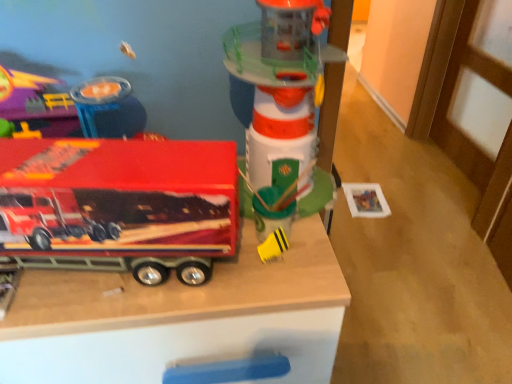
Question: Is wooden toy truck at center positioned behind yellow rubber duck at center, which is counted as the 2th toy, starting from the right?

Choices:
 (A) yes
 (B) no

Answer: (B)

Question: Is wooden toy truck at center facing away from yellow rubber duck at center, the 3th toy viewed from the left?

Choices:
 (A) no
 (B) yes

Answer: (A)

Question: Can you confirm if wooden toy truck at center is taller than yellow rubber duck at center, which is counted as the 2th toy, starting from the right?

Choices:
 (A) yes
 (B) no

Answer: (A)

Question: Does wooden toy truck at center turn towards yellow rubber duck at center, the 3th toy viewed from the left?

Choices:
 (A) yes
 (B) no

Answer: (B)

Question: Is wooden toy truck at center thinner than yellow rubber duck at center, the 3th toy viewed from the left?

Choices:
 (A) no
 (B) yes

Answer: (A)

Question: From a real-world perspective, is wooden toy truck at center positioned over yellow rubber duck at center, which is counted as the 2th toy, starting from the right, based on gravity?

Choices:
 (A) no
 (B) yes

Answer: (A)

Question: From the image's perspective, is wooden toy truck at center located beneath shiny red truck at left, the first toy positioned from the left?

Choices:
 (A) yes
 (B) no

Answer: (A)

Question: Is wooden toy truck at center oriented towards shiny red truck at left, the first toy positioned from the left?

Choices:
 (A) no
 (B) yes

Answer: (A)

Question: Can you confirm if wooden toy truck at center is shorter than shiny red truck at left, the first toy positioned from the left?

Choices:
 (A) no
 (B) yes

Answer: (A)

Question: From a real-world perspective, is wooden toy truck at center located higher than shiny red truck at left, positioned as the fourth toy in right-to-left order?

Choices:
 (A) no
 (B) yes

Answer: (A)

Question: Is wooden toy truck at center turned away from shiny red truck at left, positioned as the fourth toy in right-to-left order?

Choices:
 (A) yes
 (B) no

Answer: (B)

Question: Is wooden toy truck at center placed right next to shiny red truck at left, the first toy positioned from the left?

Choices:
 (A) yes
 (B) no

Answer: (B)

Question: Considering the relative sizes of shiny red truck at left, the first toy positioned from the left, and translucent plastic lighthouse at center, the 4th toy viewed from the left, in the image provided, is shiny red truck at left, the first toy positioned from the left, bigger than translucent plastic lighthouse at center, the 4th toy viewed from the left,?

Choices:
 (A) yes
 (B) no

Answer: (B)